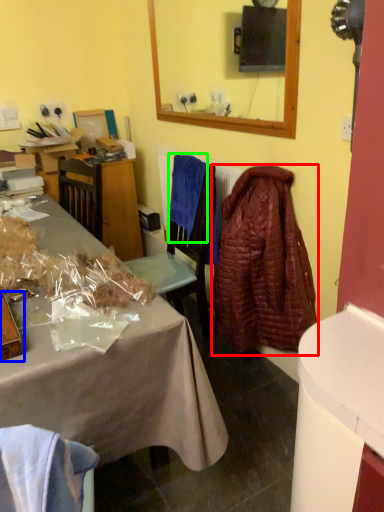
Question: Considering the real-world distances, which object is closest to robe (highlighted by a red box)? box (highlighted by a blue box) or cloth (highlighted by a green box).

Choices:
 (A) box
 (B) cloth

Answer: (B)